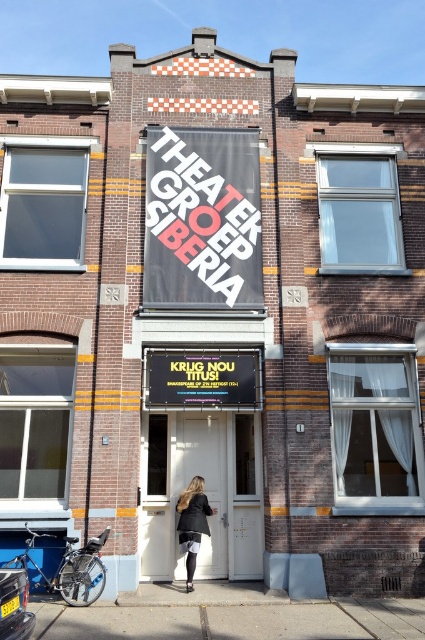
Find the location of a particular element. The height and width of the screenshot is (640, 425). black matte signboard at center is located at coordinates (203, 458).

From the picture: How far apart are black matte signboard at center and black matte sign at center?

They are 97.09 centimeters apart.

Who is more forward, (212, 435) or (187, 360)?

Point (187, 360) is more forward.

The image size is (425, 640). I want to click on black matte signboard at center, so click(203, 458).

Does black fabric sign at center appear on the left side of black matte sign at center?

In fact, black fabric sign at center is to the right of black matte sign at center.

Does point (166, 269) come behind point (218, 371)?

Yes, it is behind point (218, 371).

The width and height of the screenshot is (425, 640). In order to click on black fabric sign at center in this screenshot , I will do `click(201, 218)`.

Is point (158, 637) more distant than point (190, 545)?

No, it is not.

Find the location of a particular element. gray concrete pavement at lower center is located at coordinates pos(237,620).

You are a GUI agent. You are given a task and a screenshot of the screen. Output one action in this format:
    pyautogui.click(x=<x>, y=<y>)
    Task: Click on the gray concrete pavement at lower center
    The image size is (425, 640).
    Given the screenshot: What is the action you would take?
    (x=237, y=620)

Find the location of a particular element. gray concrete pavement at lower center is located at coordinates (237, 620).